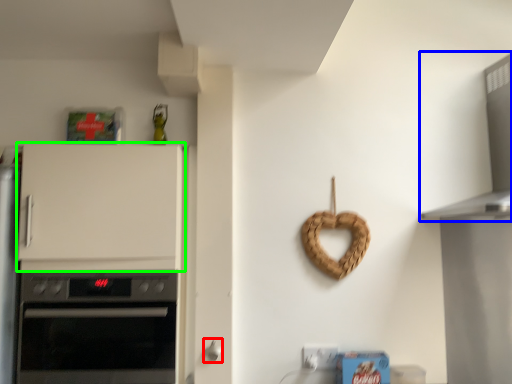
Question: Estimate the real-world distances between objects in this image. Which object is closer to door handle (highlighted by a red box), vent (highlighted by a blue box) or cabinetry (highlighted by a green box)?

Choices:
 (A) vent
 (B) cabinetry

Answer: (B)